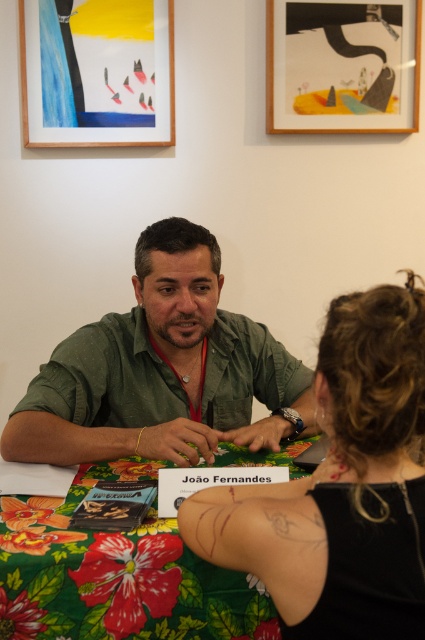
You are a tailor measuring the green matte shirt at center and the floral fabric tablecloth at center. Which item has a greater width?

The green matte shirt at center has a greater width than the floral fabric tablecloth at center.

You are standing in the room and see the point at coordinates (289, 516). If you want to place a 12 inch wide book on the table, will there be enough space between you and the point to do so?

The distance between you and the point at coordinates (289, 516) is 29.72 inches. Since the book is 12 inches wide, there is sufficient space as 29.72 inches is greater than 12 inches.

You are a photographer taking a picture of the scene. You want to ensure that both the black fabric hair at center and the green matte shirt at center are clearly visible in the photo. Based on their positions, which object should you focus on first to ensure both are in focus?

The black fabric hair at center is in front of the green matte shirt at center, so you should focus on the black fabric hair at center first to ensure both are in focus.